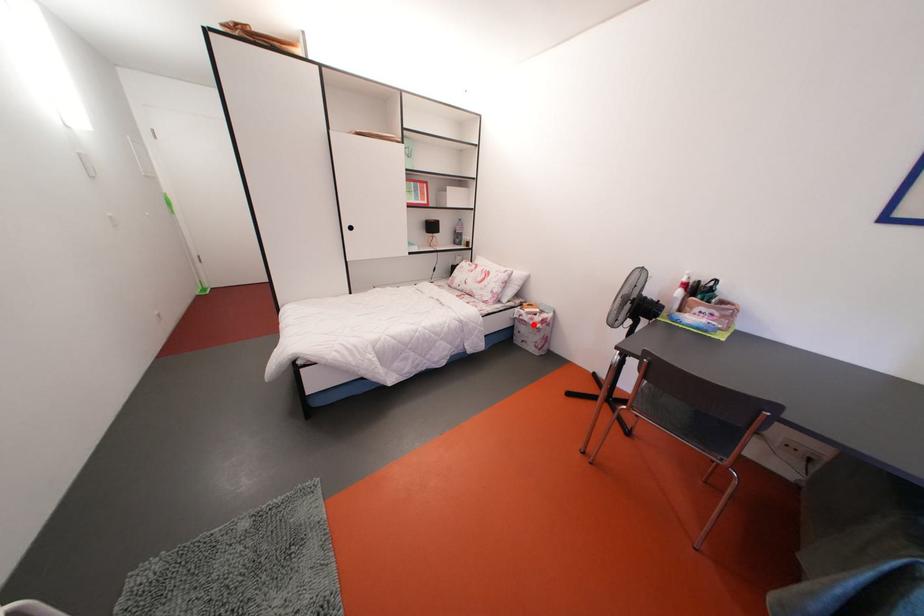
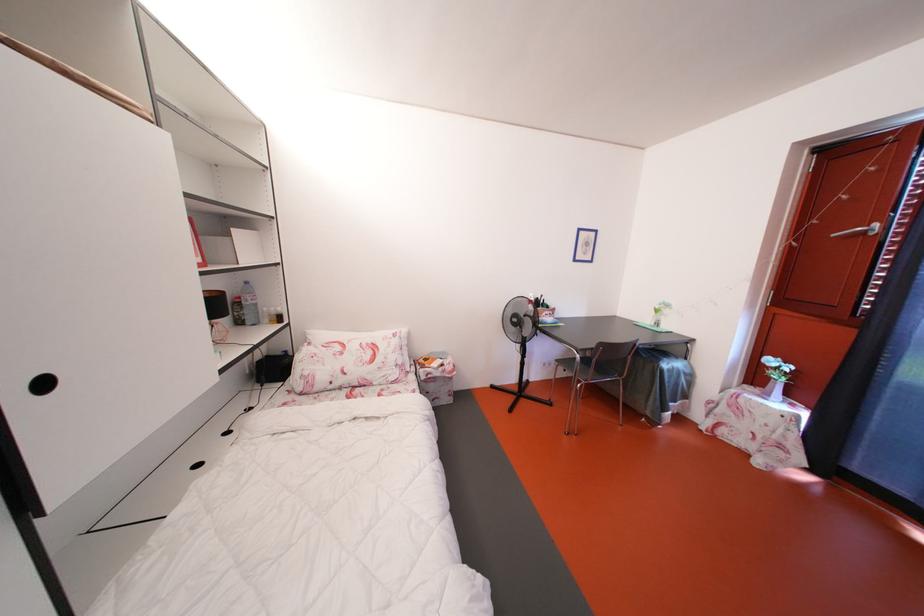
Find the pixel in the second image that matches the highlighted location in the first image.

(444, 379)